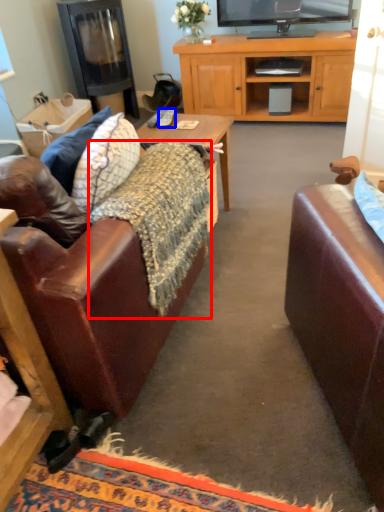
Question: Which object is closer to the camera taking this photo, blanket (highlighted by a red box) or remote control (highlighted by a blue box)?

Choices:
 (A) blanket
 (B) remote control

Answer: (A)